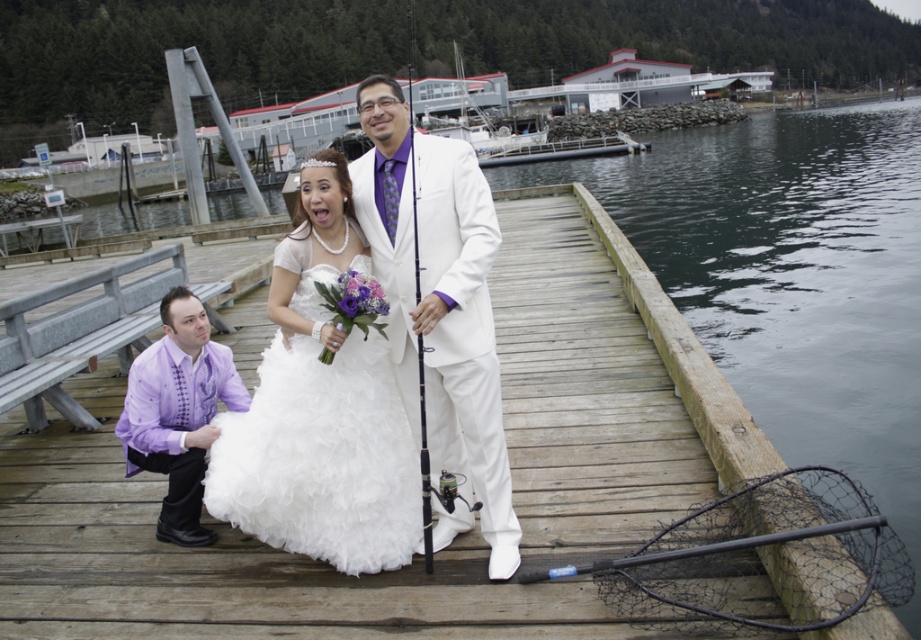
Question: Is white satin dress at center positioned before black matte fishing pole at center?

Choices:
 (A) no
 (B) yes

Answer: (B)

Question: Which object is closer to the camera taking this photo?

Choices:
 (A) white satin dress at center
 (B) dark green water at dock right
 (C) wooden at center

Answer: (C)

Question: Is wooden at center wider than purple satin shirt at lower left?

Choices:
 (A) no
 (B) yes

Answer: (B)

Question: Can you confirm if dark green water at dock right is wider than white satin dress at center?

Choices:
 (A) no
 (B) yes

Answer: (B)

Question: Among these points, which one is nearest to the camera?

Choices:
 (A) (315, 516)
 (B) (768, 346)
 (C) (426, 547)
 (D) (468, 216)

Answer: (D)

Question: Which object appears farthest from the camera in this image?

Choices:
 (A) white satin dress at center
 (B) wooden at center
 (C) dark green water at dock right
 (D) purple satin shirt at lower left

Answer: (C)